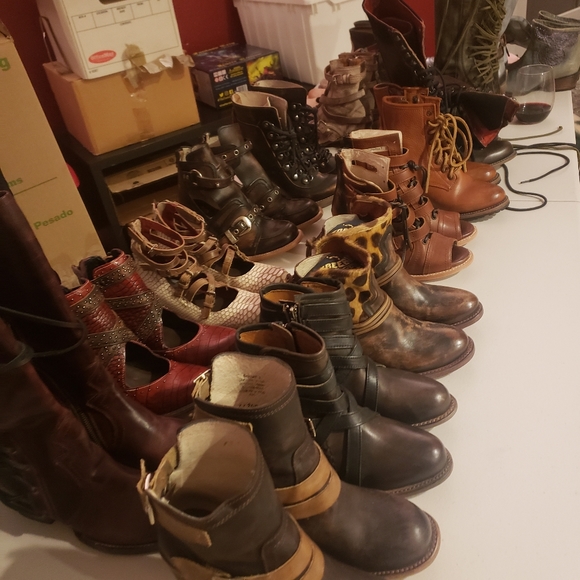
The image size is (580, 580). What are the coordinates of `wineglass` in the screenshot? It's located at (536, 97).